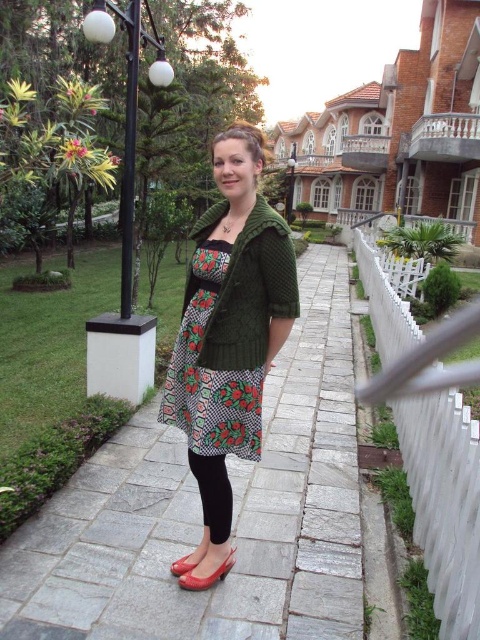
Question: Among these points, which one is farthest from the camera?

Choices:
 (A) (252, 241)
 (B) (120, 16)
 (C) (331, 340)
 (D) (203, 282)

Answer: (C)

Question: Which point appears closest to the camera in this image?

Choices:
 (A) (254, 209)
 (B) (203, 416)
 (C) (343, 436)
 (D) (218, 540)

Answer: (B)

Question: Which point is closer to the camera?

Choices:
 (A) (218, 568)
 (B) (186, 564)
 (C) (200, 627)
 (D) (157, 76)

Answer: (C)

Question: Considering the relative positions of black metal lamp post at upper left and matte red shoe at lower center in the image provided, where is black metal lamp post at upper left located with respect to matte red shoe at lower center?

Choices:
 (A) below
 (B) above

Answer: (B)

Question: From the image, what is the correct spatial relationship of black matte leggings at center in relation to matte red shoe at lower center?

Choices:
 (A) below
 (B) above

Answer: (B)

Question: Is black metal lamp post at upper left above matte red shoe at lower center?

Choices:
 (A) no
 (B) yes

Answer: (B)